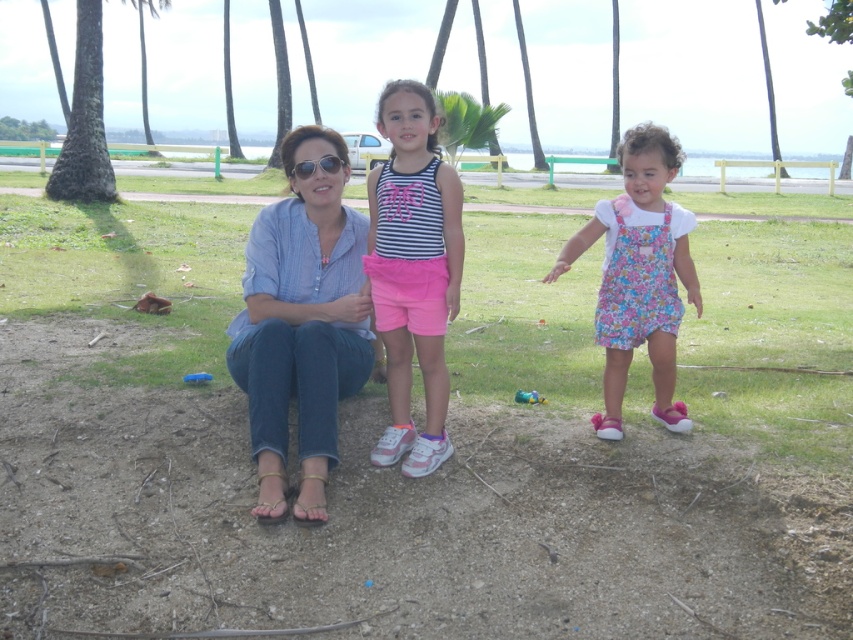
Question: Estimate the real-world distances between objects in this image. Which object is farther from the matte black sunglasses at center?

Choices:
 (A) green leafy palm tree at upper center
 (B) striped fabric tank top at center
 (C) floral fabric dress at right
 (D) green leafy palm tree at center

Answer: (A)

Question: Estimate the real-world distances between objects in this image. Which object is farther from the green leafy palm tree at upper center?

Choices:
 (A) green leafy palm tree at center
 (B) floral fabric dress at right

Answer: (B)

Question: Can you confirm if denim jeans at center is positioned to the right of matte black sunglasses at center?

Choices:
 (A) yes
 (B) no

Answer: (A)

Question: Can you confirm if denim shirt at center is smaller than floral fabric dress at right?

Choices:
 (A) no
 (B) yes

Answer: (A)

Question: Can you confirm if denim jeans at center is smaller than green leafy palm tree at upper center?

Choices:
 (A) yes
 (B) no

Answer: (A)

Question: Among these objects, which one is nearest to the camera?

Choices:
 (A) floral fabric dress at right
 (B) denim shirt at center
 (C) striped fabric tank top at center

Answer: (B)